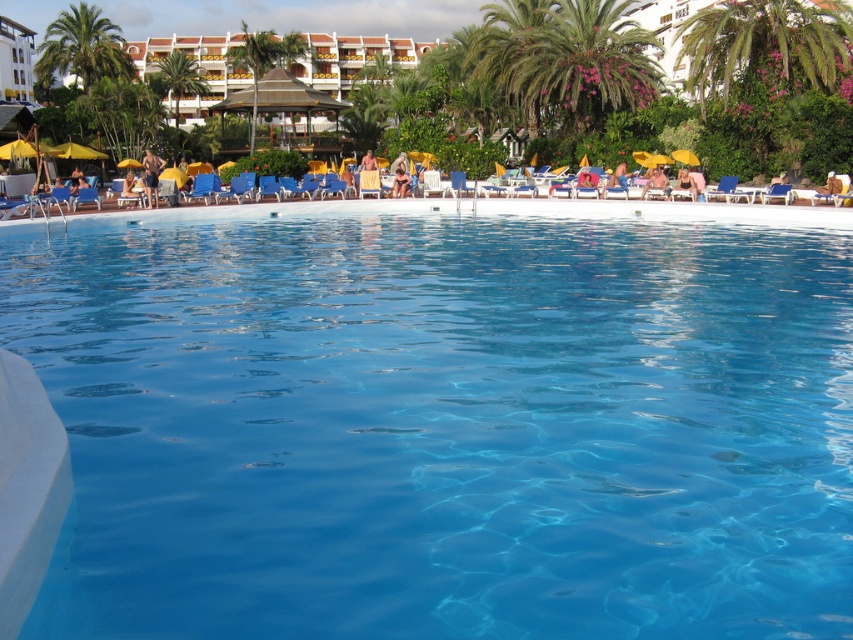
Between transparent glass pool at center and matte black bikini at center, which one is positioned lower?

transparent glass pool at center

Is point (519, 620) positioned after point (403, 189)?

No, it is not.

Identify the location of transparent glass pool at center. (444, 422).

Can you confirm if green leafy palm tree at upper left is positioned below tan skin man at left?

Actually, green leafy palm tree at upper left is above tan skin man at left.

The width and height of the screenshot is (853, 640). In order to click on green leafy palm tree at upper left in this screenshot , I will do `click(80, 48)`.

Locate an element on the screen. green leafy palm tree at upper left is located at coordinates (80, 48).

Is point (786, 16) in front of point (364, 163)?

No, it is behind (364, 163).

At what (x,y) coordinates should I click in order to perform the action: click on green leafy palm tree at upper right. Please return your answer as a coordinate pair (x, y). The image size is (853, 640). Looking at the image, I should click on (766, 42).